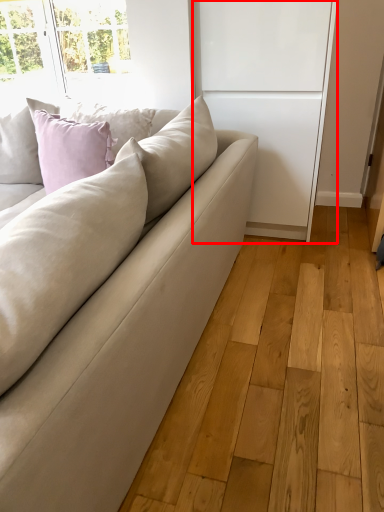
Question: Considering the relative positions of screen door (annotated by the red box) and studio couch in the image provided, where is screen door (annotated by the red box) located with respect to the staircase?

Choices:
 (A) left
 (B) right

Answer: (B)